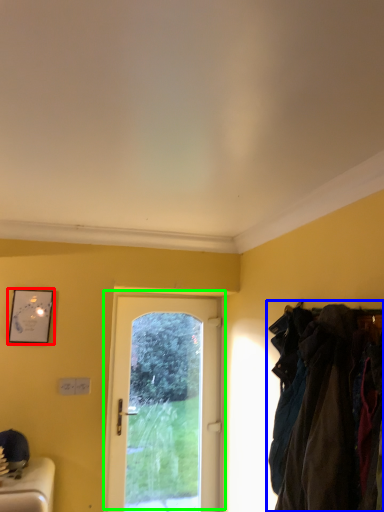
Question: Based on their relative distances, which object is farther from picture frame (highlighted by a red box)? Choose from laundry (highlighted by a blue box) and door (highlighted by a green box).

Choices:
 (A) laundry
 (B) door

Answer: (A)